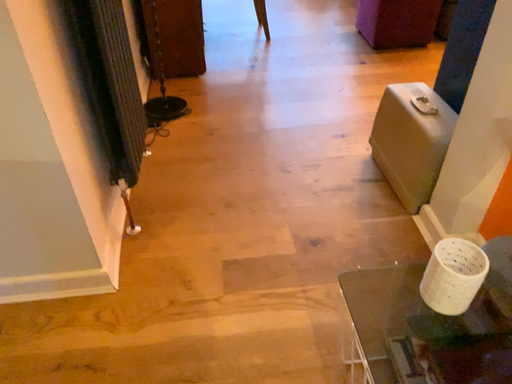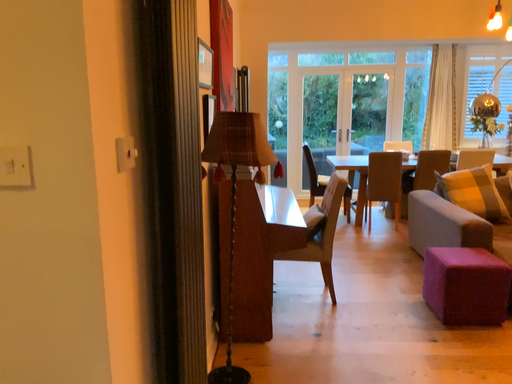
Question: Which way did the camera rotate in the video?

Choices:
 (A) rotated downward
 (B) rotated upward

Answer: (B)